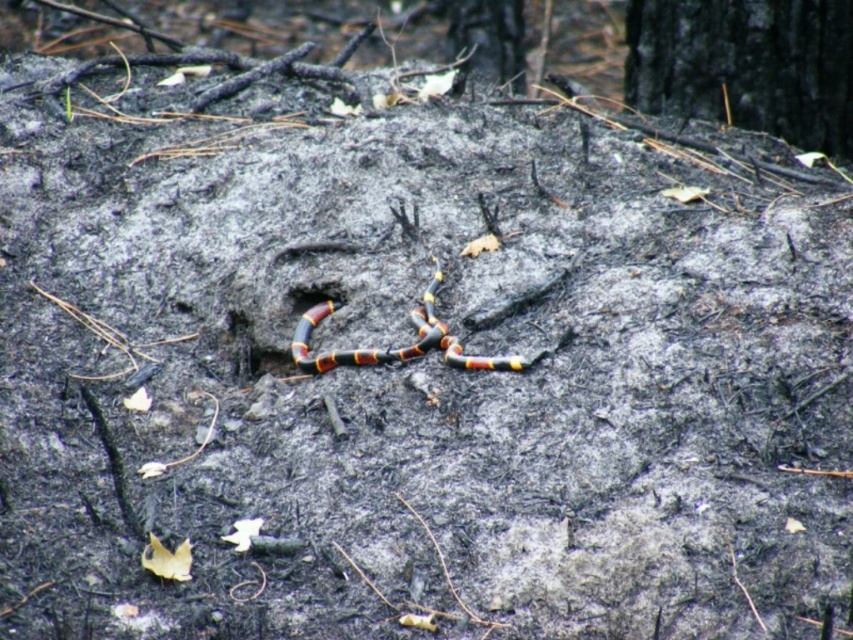
You are standing at the edge of a burned forest floor. You see a point marked at coordinates (x=489, y=36). Based on the scene description, what is the location of this point relative to the smooth dark brown tree trunk at upper center?

The point at coordinates (x=489, y=36) is located on the smooth dark brown tree trunk at upper center.